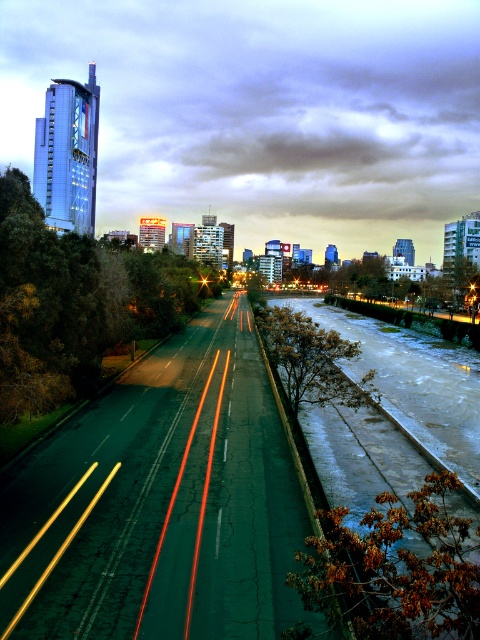
Question: Does green asphalt highway at center have a lesser width compared to icy concrete river at center-right?

Choices:
 (A) no
 (B) yes

Answer: (B)

Question: Which point is closer to the camera taking this photo?

Choices:
 (A) (75, 492)
 (B) (417, 554)

Answer: (B)

Question: Can you confirm if green asphalt highway at center is positioned below icy concrete river at center-right?

Choices:
 (A) no
 (B) yes

Answer: (A)

Question: Can you confirm if green asphalt highway at center is smaller than icy concrete river at center-right?

Choices:
 (A) yes
 (B) no

Answer: (A)